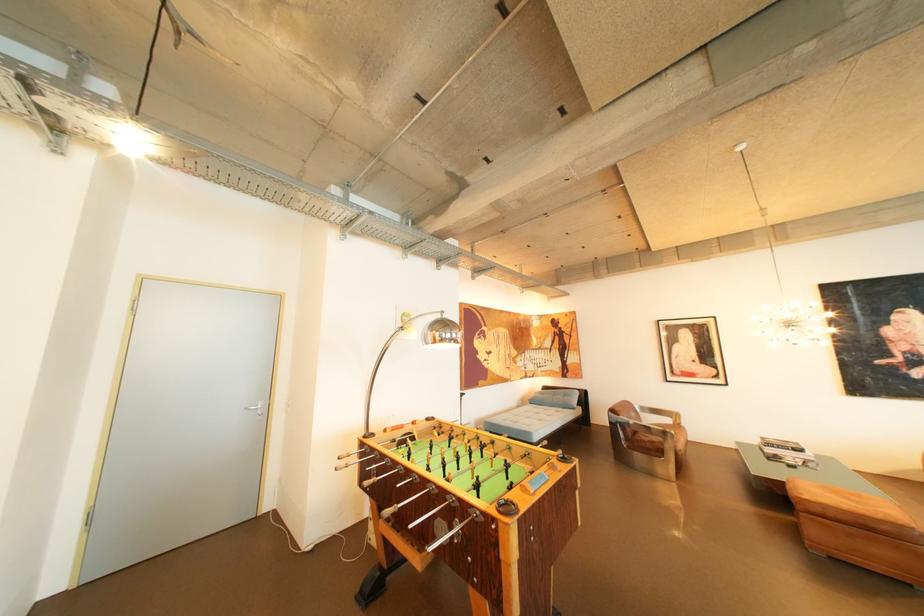
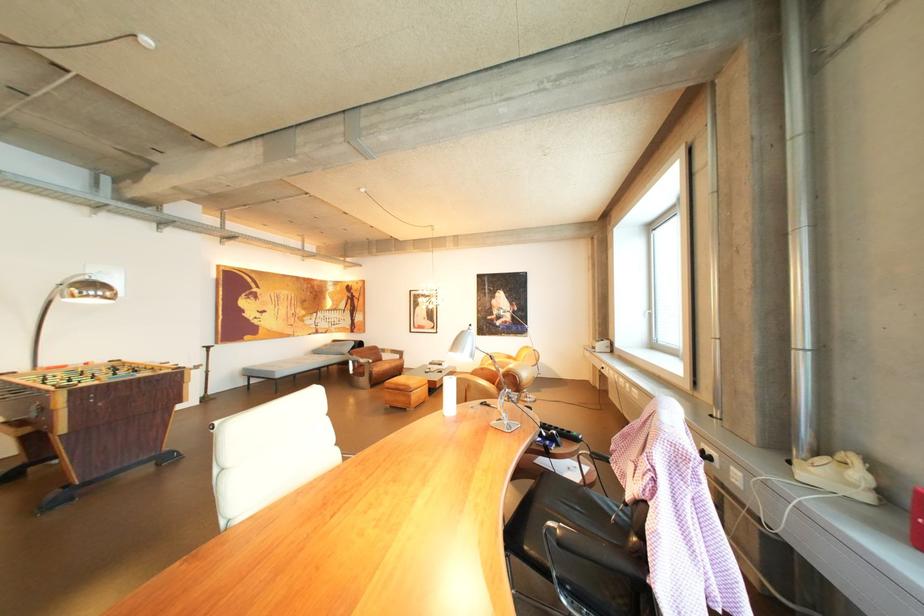
What movement of the cameraman would produce the second image?

The cameraman walked toward right, backward.